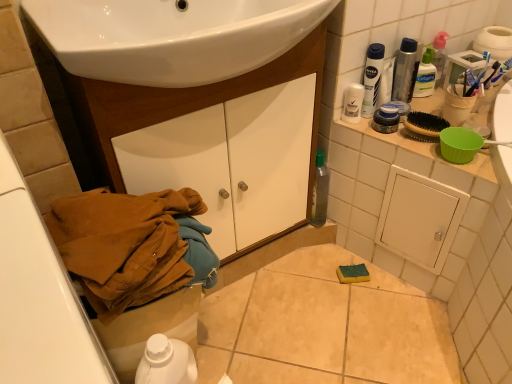
In order to click on spots to the right of metallic silver spray can at upper right in this screenshot , I will do `click(461, 107)`.